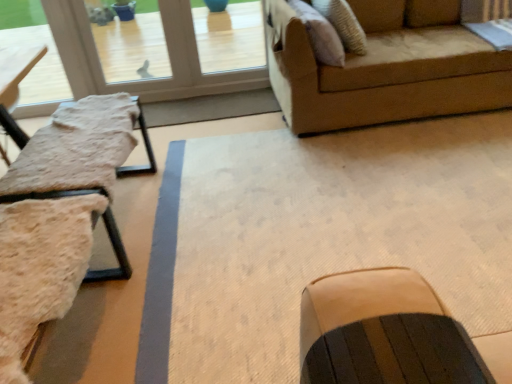
Question: Can you confirm if transparent glass door at upper left is smaller than suede-like beige pillow at upper right?

Choices:
 (A) no
 (B) yes

Answer: (A)

Question: Is suede-like beige pillow at upper right a part of transparent glass door at upper left?

Choices:
 (A) no
 (B) yes

Answer: (A)

Question: Is transparent glass door at upper left shorter than suede-like beige pillow at upper right?

Choices:
 (A) yes
 (B) no

Answer: (B)

Question: From the image's perspective, is transparent glass door at upper left above suede-like beige pillow at upper right?

Choices:
 (A) yes
 (B) no

Answer: (A)

Question: Does transparent glass door at upper left have a larger size compared to suede-like beige pillow at upper right?

Choices:
 (A) yes
 (B) no

Answer: (A)

Question: From the image's perspective, is transparent glass door at upper left positioned above or below beige fabric swivel chair at left?

Choices:
 (A) above
 (B) below

Answer: (A)

Question: Visually, is transparent glass door at upper left positioned to the left or to the right of beige fabric swivel chair at left?

Choices:
 (A) left
 (B) right

Answer: (A)

Question: From their relative heights in the image, would you say transparent glass door at upper left is taller or shorter than beige fabric swivel chair at left?

Choices:
 (A) short
 (B) tall

Answer: (B)

Question: Looking at their shapes, would you say transparent glass door at upper left is wider or thinner than beige fabric swivel chair at left?

Choices:
 (A) thin
 (B) wide

Answer: (A)

Question: From the image's perspective, is transparent glass door at upper left located above or below dark brown leather rocking chair at center?

Choices:
 (A) above
 (B) below

Answer: (A)

Question: Considering their positions, is transparent glass door at upper left located in front of or behind dark brown leather rocking chair at center?

Choices:
 (A) behind
 (B) front

Answer: (A)

Question: Based on their sizes in the image, would you say transparent glass door at upper left is bigger or smaller than dark brown leather rocking chair at center?

Choices:
 (A) small
 (B) big

Answer: (B)

Question: Is transparent glass door at upper left inside the boundaries of dark brown leather rocking chair at center, or outside?

Choices:
 (A) inside
 (B) outside

Answer: (B)

Question: In terms of size, does fuzzy fabric table at left appear bigger or smaller than transparent glass door at upper left?

Choices:
 (A) big
 (B) small

Answer: (A)

Question: From a real-world perspective, relative to transparent glass door at upper left, is fuzzy fabric table at left vertically above or below?

Choices:
 (A) below
 (B) above

Answer: (A)